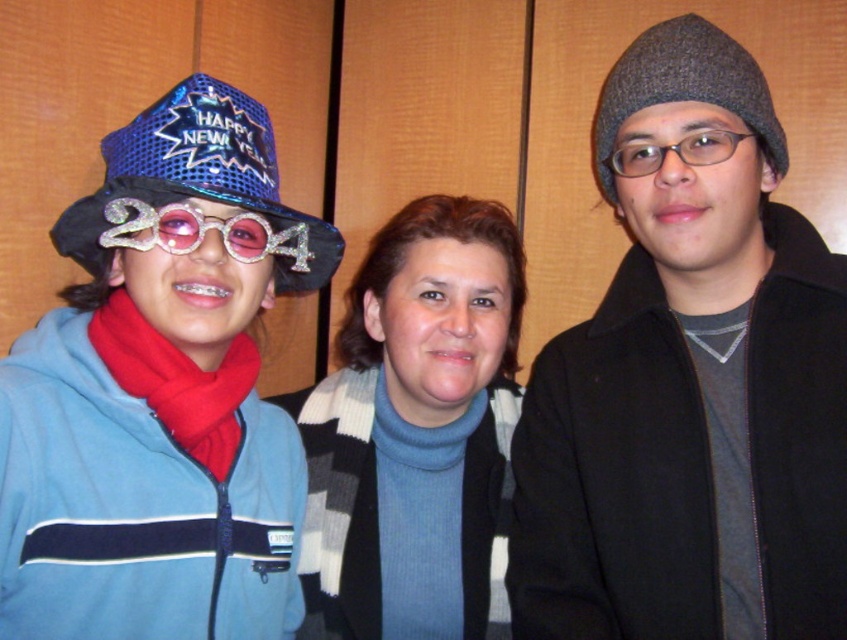
You are a fashion stylist preparing for a winter photoshoot. You have two accessories to choose from in the image provided. The gray woolen beanie at right and the red fleece scarf at left. Based on their sizes, which accessory would you recommend to a client who prefers larger headwear for a bold look?

The gray woolen beanie at right has a larger size compared to the red fleece scarf at left, so it would be the better choice for a bold look due to its larger size.

You are observing a group of people in a photo. You notice the blue knit sweater at center and the transparent plastic goggles at right. According to the image, which object is positioned higher?

The transparent plastic goggles at right are positioned higher than the blue knit sweater at center.

You are organizing a charity clothing drive and need to decide which items to donate. You have a blue knit sweater at center and a red fleece scarf at left. Based on their sizes, which item would be more suitable for donating to an adult recipient?

The blue knit sweater at center is bigger than the red fleece scarf at left, so it would be more suitable for donating to an adult recipient since it is larger and likely appropriate for an adult size.